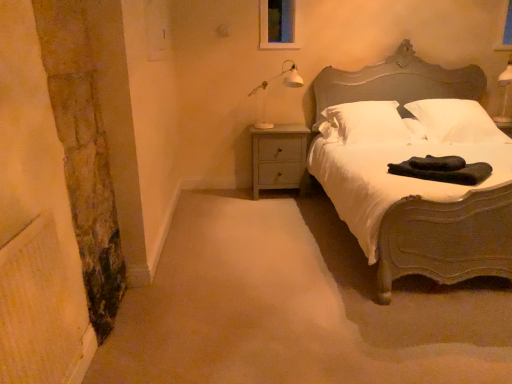
Question: Which is correct: white painted wood nightstand at lower left is inside transparent glass window at upper center, or outside of it?

Choices:
 (A) outside
 (B) inside

Answer: (A)

Question: From a real-world perspective, is white painted wood nightstand at lower left above or below transparent glass window at upper center?

Choices:
 (A) above
 (B) below

Answer: (B)

Question: Which is farther from the matte gray bed at right?

Choices:
 (A) dark green fabric at bed
 (B) transparent glass window at upper center
 (C) white glossy lamp at upper right
 (D) white soft pillow at center, the 2th pillow positioned from the right
 (E) white soft pillow at upper right, the second pillow positioned from the left

Answer: (A)

Question: Considering the real-world distances, which object is farthest from the transparent glass window at upper center?

Choices:
 (A) white soft pillow at upper right, which ranks as the 1th pillow in right-to-left order
 (B) matte gray bed at right
 (C) dark green fabric at bed
 (D) white soft pillow at center, the 2th pillow positioned from the right
 (E) white painted wood nightstand at lower left

Answer: (C)